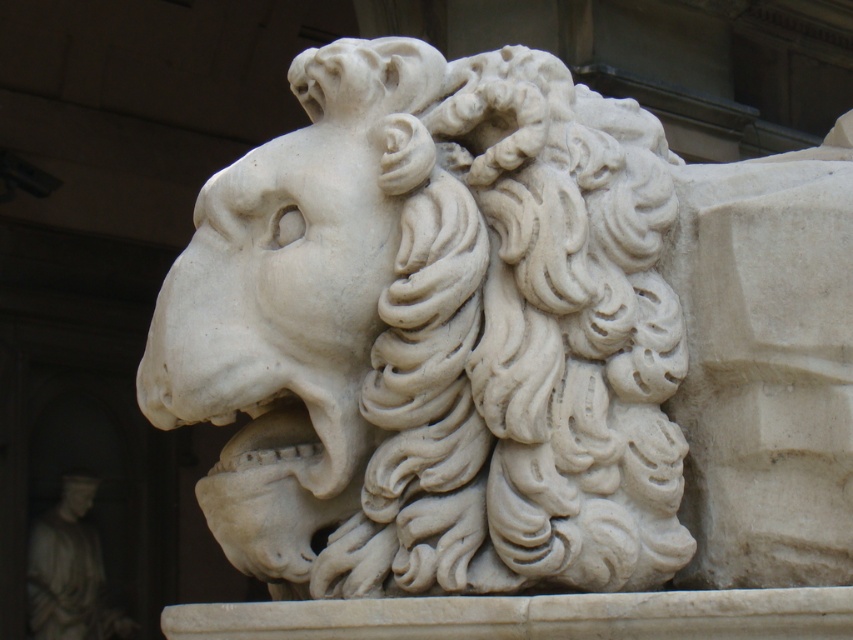
You are an art curator examining two sculptures in the image. You notice both the white marble lion at center and the white marble lion at upper center. Which of these two lions appears bigger in size?

The white marble lion at center is larger in size than the white marble lion at upper center.